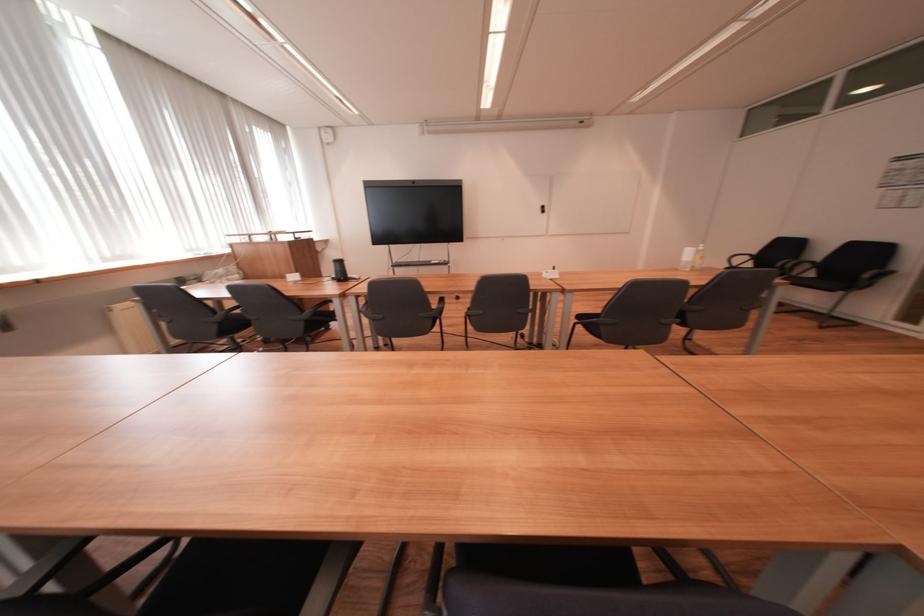
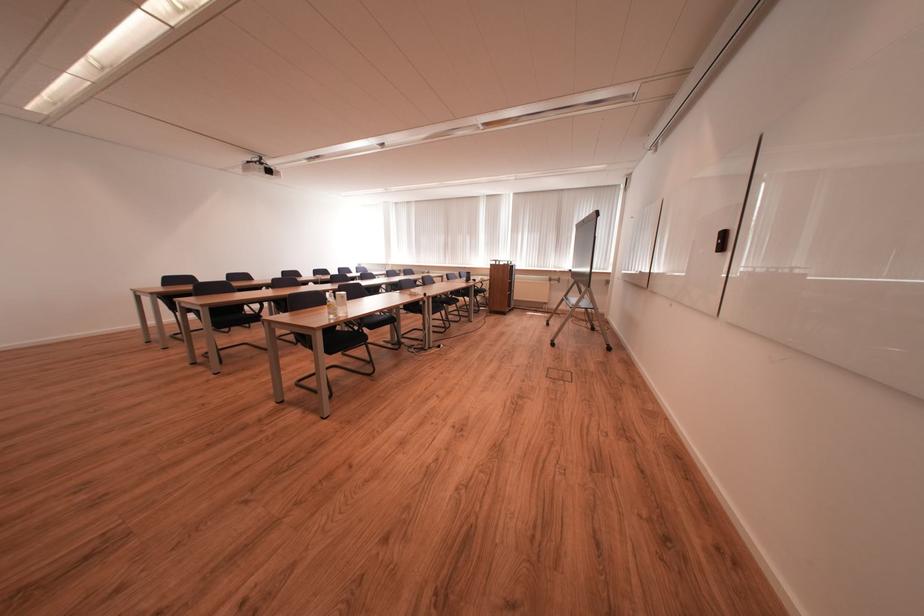
Question: I am providing you with two images of the same scene from different viewpoints. Which of the following objects are not visible in image2?

Choices:
 (A) chair sitting surface
 (B) black blind handle
 (C) clear plastic bottle
 (D) black chair sitting surface

Answer: (A)